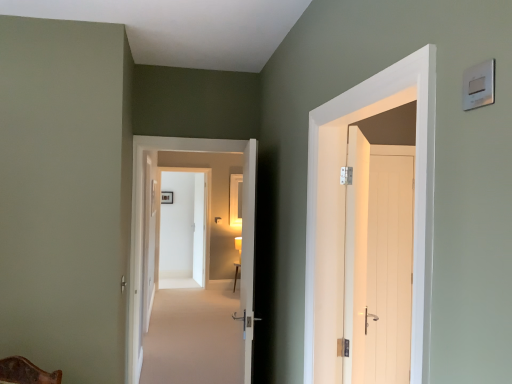
Question: Does white glossy door at center, the 2th door positioned from the back, come behind beige carpet at center?

Choices:
 (A) no
 (B) yes

Answer: (B)

Question: Would you say white glossy door at center, placed as the 1th door when sorted from left to right, is outside beige carpet at center?

Choices:
 (A) no
 (B) yes

Answer: (B)

Question: Does white glossy door at center, the 5th door positioned from the front, have a lesser width compared to beige carpet at center?

Choices:
 (A) yes
 (B) no

Answer: (A)

Question: Can you confirm if white glossy door at center, the 5th door positioned from the front, is positioned to the right of beige carpet at center?

Choices:
 (A) yes
 (B) no

Answer: (B)

Question: Considering the relative sizes of white glossy door at center, the 2th door positioned from the back, and beige carpet at center in the image provided, is white glossy door at center, the 2th door positioned from the back, wider than beige carpet at center?

Choices:
 (A) yes
 (B) no

Answer: (B)

Question: Is white glossy door at center, placed as the 1th door when sorted from left to right, bigger than beige carpet at center?

Choices:
 (A) yes
 (B) no

Answer: (B)

Question: Could you tell me if white wooden door at center, acting as the sixth door starting from the front, is facing white wooden door at upper right, which is the 2th door in right-to-left order?

Choices:
 (A) yes
 (B) no

Answer: (B)

Question: Can you confirm if white wooden door at center, which appears as the first door when viewed from the back, is wider than white wooden door at upper right, which appears as the sixth door when viewed from the back?

Choices:
 (A) no
 (B) yes

Answer: (A)

Question: Does white wooden door at center, which ranks as the 2th door in left-to-right order, come in front of white wooden door at upper right, which appears as the first door when viewed from the front?

Choices:
 (A) no
 (B) yes

Answer: (A)

Question: Does white wooden door at center, which ranks as the 2th door in left-to-right order, appear on the left side of white wooden door at upper right, which is the 2th door in right-to-left order?

Choices:
 (A) no
 (B) yes

Answer: (B)

Question: Is white wooden door at center, acting as the sixth door starting from the front, thinner than white wooden door at upper right, which appears as the first door when viewed from the front?

Choices:
 (A) yes
 (B) no

Answer: (A)

Question: From a real-world perspective, is white wooden door at center, which appears as the first door when viewed from the back, under white wooden door at upper right, which appears as the sixth door when viewed from the back?

Choices:
 (A) yes
 (B) no

Answer: (A)

Question: Can you confirm if silver metallic light switch at upper right is thinner than white wood door at right, the third door viewed from the back?

Choices:
 (A) no
 (B) yes

Answer: (B)